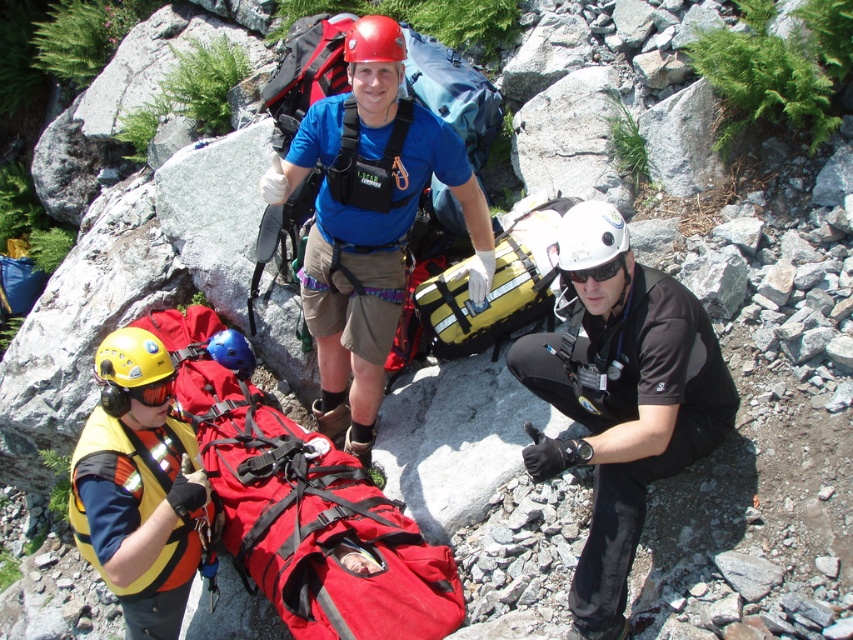
Question: Based on their relative distances, which object is farther from the red matte helmet at center?

Choices:
 (A) black matte goggles at center
 (B) black matte helmet at lower right

Answer: (B)

Question: Does yellow fabric backpack at center appear over black matte goggles at center?

Choices:
 (A) no
 (B) yes

Answer: (A)

Question: Which of these objects is positioned closest to the yellow matte helmet at center?

Choices:
 (A) yellow matte helmet at lower left
 (B) orange/yellow fabric safety vest at lower left

Answer: (A)

Question: Does yellow matte helmet at lower left have a greater width compared to red matte helmet at center?

Choices:
 (A) yes
 (B) no

Answer: (A)

Question: Based on their relative distances, which object is nearer to the red fabric stretcher at center?

Choices:
 (A) blue fabric shirt at center
 (B) white matte helmet at center

Answer: (A)

Question: Is orange/yellow fabric safety vest at lower left below white matte helmet at center?

Choices:
 (A) yes
 (B) no

Answer: (A)